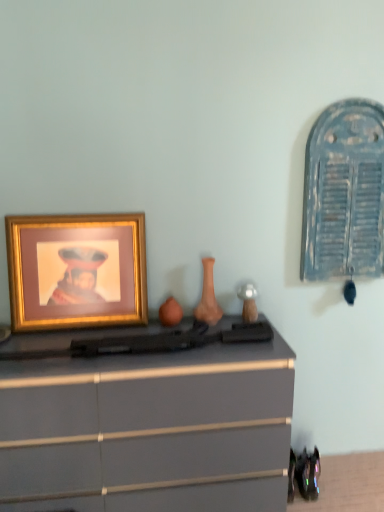
Find the location of `vacant area on top of matte gray chest of drawers at center (from a real-world perspective)`. vacant area on top of matte gray chest of drawers at center (from a real-world perspective) is located at coordinates (107, 337).